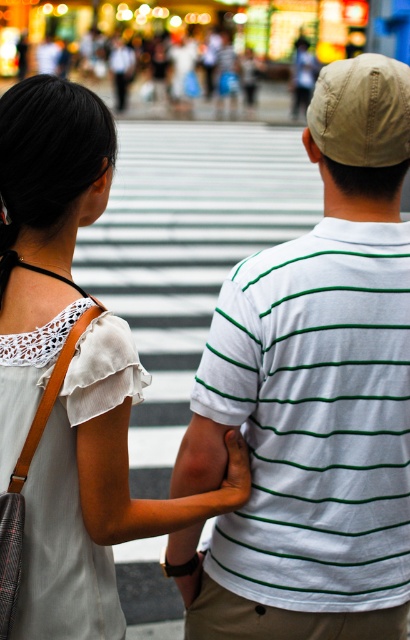
Question: Which of the following is the farthest from the observer?

Choices:
 (A) white lace blouse at upper left
 (B) white striped shirt at center
 (C) orange smooth skin at lower center

Answer: (C)

Question: Which object is positioned closest to the white lace blouse at upper left?

Choices:
 (A) orange smooth skin at lower center
 (B) white striped shirt at center

Answer: (B)

Question: Is white striped shirt at center closer to camera compared to white lace blouse at upper left?

Choices:
 (A) yes
 (B) no

Answer: (B)

Question: Which object is farther from the camera taking this photo?

Choices:
 (A) orange smooth skin at lower center
 (B) white lace blouse at upper left

Answer: (A)

Question: Is white striped shirt at center to the left of white lace blouse at upper left from the viewer's perspective?

Choices:
 (A) no
 (B) yes

Answer: (A)

Question: Is white striped shirt at center thinner than white lace blouse at upper left?

Choices:
 (A) no
 (B) yes

Answer: (A)